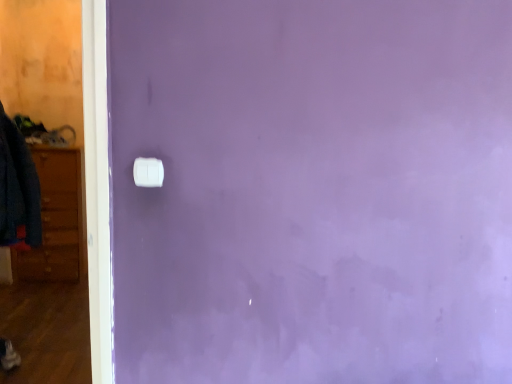
Question: Based on their positions, is white plastic light switch at center located to the left or right of denim jacket at left?

Choices:
 (A) right
 (B) left

Answer: (A)

Question: From the image's perspective, is white plastic light switch at center located above or below denim jacket at left?

Choices:
 (A) above
 (B) below

Answer: (B)

Question: Based on their sizes in the image, would you say white plastic light switch at center is bigger or smaller than denim jacket at left?

Choices:
 (A) big
 (B) small

Answer: (B)

Question: Is point (7, 165) positioned closer to the camera than point (155, 167)?

Choices:
 (A) closer
 (B) farther

Answer: (B)

Question: Considering their positions, is denim jacket at left located in front of or behind white plastic light switch at center?

Choices:
 (A) behind
 (B) front

Answer: (A)

Question: From the image's perspective, is denim jacket at left above or below white plastic light switch at center?

Choices:
 (A) below
 (B) above

Answer: (B)

Question: Considering the positions of denim jacket at left and white plastic light switch at center in the image, is denim jacket at left wider or thinner than white plastic light switch at center?

Choices:
 (A) wide
 (B) thin

Answer: (A)